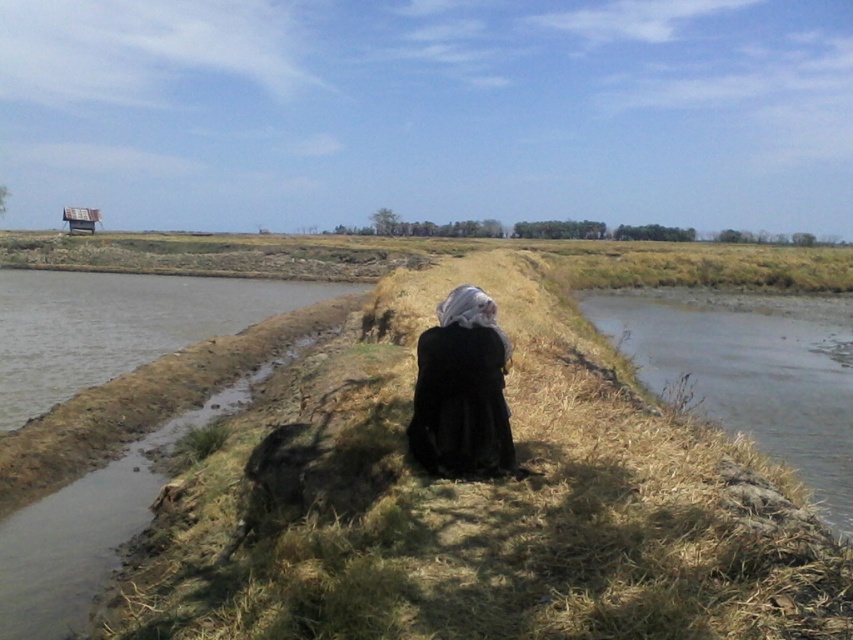
Question: Which object appears closest to the camera in this image?

Choices:
 (A) black matte dress at center
 (B) dry grass at center

Answer: (B)

Question: Which point is closer to the camera?

Choices:
 (A) dry grass at center
 (B) black matte dress at center

Answer: (A)

Question: Is dry grass at center to the right of black matte dress at center from the viewer's perspective?

Choices:
 (A) yes
 (B) no

Answer: (A)

Question: In this image, where is dry grass at center located relative to black matte dress at center?

Choices:
 (A) above
 (B) below

Answer: (A)

Question: From the image, what is the correct spatial relationship of dry grass at center in relation to black matte dress at center?

Choices:
 (A) left
 (B) right

Answer: (B)